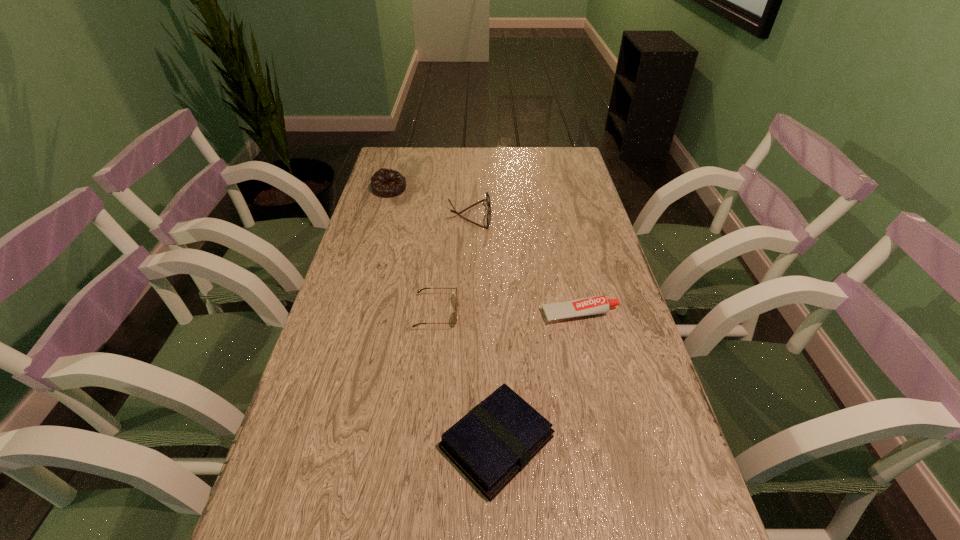
Where is `the leftmost object`? The height and width of the screenshot is (540, 960). the leftmost object is located at coordinates (385, 182).

Where is `beanbag`? This screenshot has width=960, height=540. beanbag is located at coordinates (385, 182).

Locate an element on the screen. sunglasses is located at coordinates (455, 314).

Where is `spectacles`? This screenshot has height=540, width=960. spectacles is located at coordinates (488, 218).

The width and height of the screenshot is (960, 540). Identify the location of the nearest object. (490, 445).

At what (x,y) coordinates should I click in order to perform the action: click on the rightmost object. Please return your answer as a coordinate pair (x, y). The width and height of the screenshot is (960, 540). Looking at the image, I should click on (594, 305).

What are the coordinates of `toothpaste` in the screenshot? It's located at (594, 305).

Image resolution: width=960 pixels, height=540 pixels. In order to click on free space located 0.070m on the right of the beanbag in this screenshot , I will do `click(427, 189)`.

I want to click on vacant space located 0.400m on the lenses of the sunglasses, so click(x=622, y=313).

Find the location of a particular element. vacant position located on the front-facing side of the spectacles is located at coordinates (562, 215).